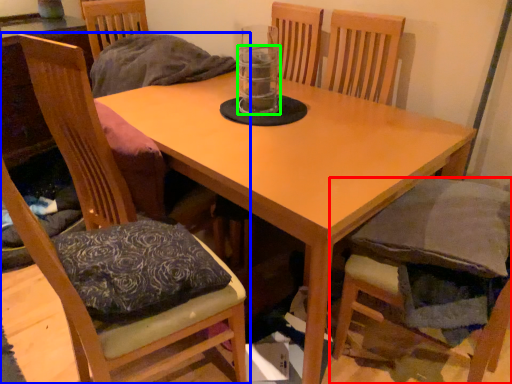
Question: Which object is positioned closest to chair (highlighted by a red box)? Select from chair (highlighted by a blue box) and beverage (highlighted by a green box).

Choices:
 (A) chair
 (B) beverage

Answer: (B)